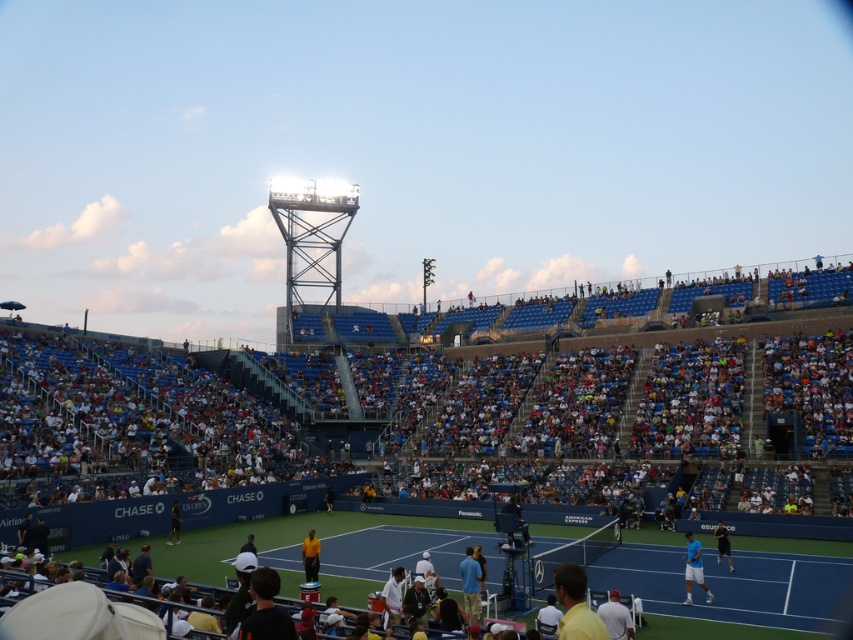
Can you confirm if blue fabric shirt at center is positioned to the left of yellow fabric shirt at center?

Incorrect, blue fabric shirt at center is not on the left side of yellow fabric shirt at center.

The width and height of the screenshot is (853, 640). Describe the element at coordinates (469, 586) in the screenshot. I see `blue fabric shirt at center` at that location.

Between point (479, 609) and point (316, 550), which one is positioned behind?

The point (316, 550) is behind.

The width and height of the screenshot is (853, 640). I want to click on blue fabric shirt at center, so click(469, 586).

Can you confirm if yellow matte shirt at lower center is positioned to the right of dark blue shirt at lower right?

Incorrect, yellow matte shirt at lower center is not on the right side of dark blue shirt at lower right.

Which is below, yellow matte shirt at lower center or dark blue shirt at lower right?

dark blue shirt at lower right is below.

Image resolution: width=853 pixels, height=640 pixels. What do you see at coordinates (575, 604) in the screenshot? I see `yellow matte shirt at lower center` at bounding box center [575, 604].

At what (x,y) coordinates should I click in order to perform the action: click on yellow matte shirt at lower center. Please return your answer as a coordinate pair (x, y). Looking at the image, I should click on [x=575, y=604].

Is the position of dark blue shirt at lower right less distant than that of dark blue shirt at lower left?

Yes.

From the picture: Is dark blue shirt at lower right above dark blue shirt at lower left?

Correct, dark blue shirt at lower right is located above dark blue shirt at lower left.

Between point (718, 541) and point (173, 502), which one is positioned behind?

Point (173, 502)

At what (x,y) coordinates should I click in order to perform the action: click on dark blue shirt at lower right. Please return your answer as a coordinate pair (x, y). Looking at the image, I should click on click(x=722, y=544).